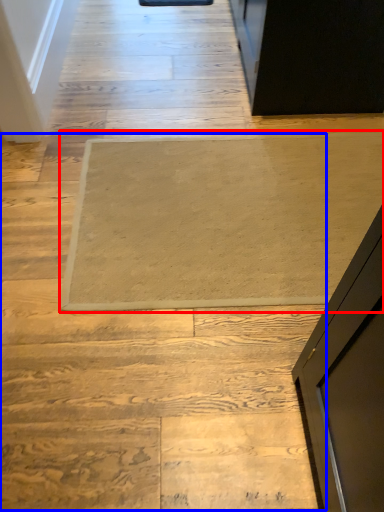
Question: Which of the following is the closest to the observer, mat (highlighted by a red box) or stairwell (highlighted by a blue box)?

Choices:
 (A) mat
 (B) stairwell

Answer: (B)